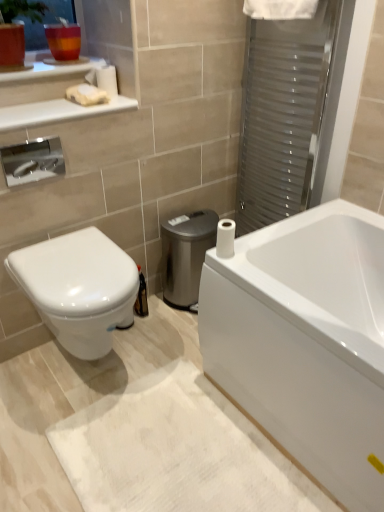
Question: From a real-world perspective, relative to white matte soap at upper left, is white glossy bathtub at lower right vertically above or below?

Choices:
 (A) above
 (B) below

Answer: (B)

Question: Is point (377, 305) positioned closer to the camera than point (6, 116)?

Choices:
 (A) farther
 (B) closer

Answer: (A)

Question: Considering the real-world distances, which object is farthest from the white glossy toilet at lower left?

Choices:
 (A) metallic silver water heater at center
 (B) white soft bath mat at lower center
 (C) translucent glass cup at upper left
 (D) white matte toilet paper at upper left, the first toilet paper when ordered from back to front
 (E) white matte toilet paper at lower right, marked as the 2th toilet paper in a back-to-front arrangement

Answer: (C)

Question: Based on their relative distances, which object is nearer to the transparent plastic screen door at upper right?

Choices:
 (A) white glossy toilet at lower left
 (B) metallic silver water heater at center
 (C) white matte toilet paper at lower right, which is the second toilet paper from left to right
 (D) white soft bath mat at lower center
 (E) white glossy bathtub at lower right

Answer: (B)